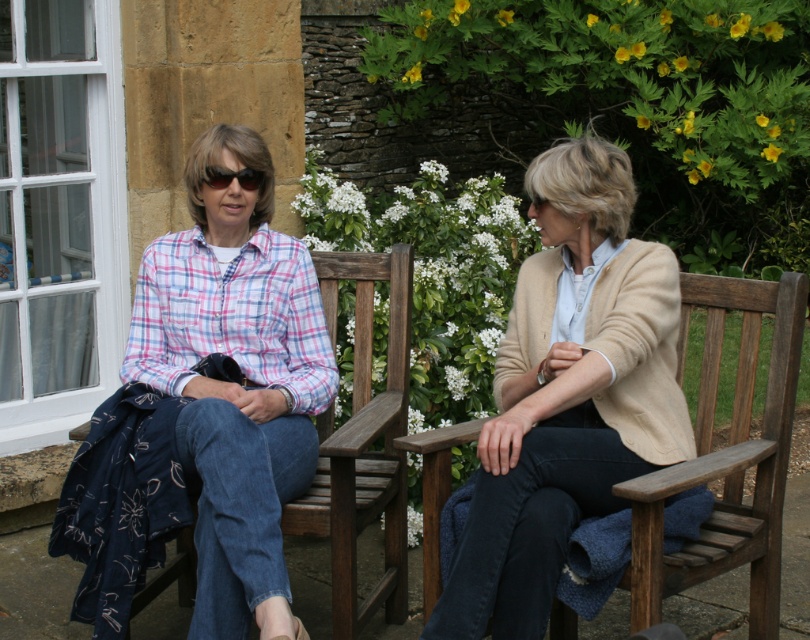
You are a photographer taking a picture of the beige wool cardigan at center and the black plastic sunglasses at upper left. Which item should you focus on first if you want to capture both in sharp focus?

The beige wool cardigan at center is closer to the viewer than the black plastic sunglasses at upper left, so you should focus on the beige wool cardigan at center first to ensure both are in focus.

You are trying to place the black plastic sunglasses at upper left on the wooden bench at left. Can you determine if they will fit based on their sizes?

The wooden bench at left might be wider than black plastic sunglasses at upper left, so there is a possibility that the sunglasses will fit on the bench.